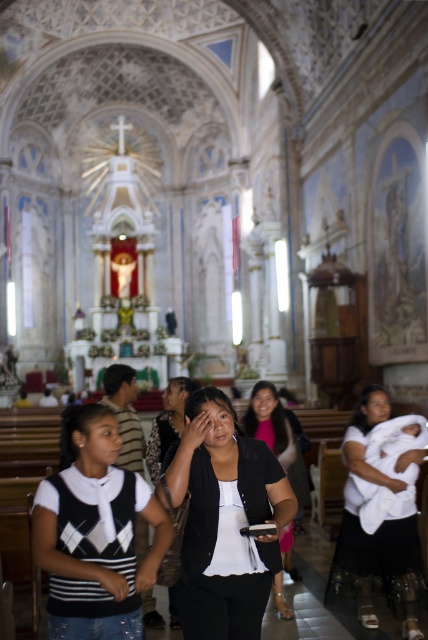
Question: Is black matte shirt at center further to the viewer compared to white knit sweater at center?

Choices:
 (A) yes
 (B) no

Answer: (A)

Question: Is black matte shirt at center in front of matte black shirt at center?

Choices:
 (A) yes
 (B) no

Answer: (A)

Question: Which of the following is the farthest from the observer?

Choices:
 (A) white knit sweater at center
 (B) black matte dress at center
 (C) black matte shirt at center

Answer: (C)

Question: Which object is positioned farthest from the white knit sweater at center?

Choices:
 (A) black matte dress at center
 (B) white cloth at center
 (C) black matte shirt at center
 (D) matte black shirt at center

Answer: (B)

Question: Is black matte dress at center positioned behind matte black shirt at center?

Choices:
 (A) no
 (B) yes

Answer: (A)

Question: Estimate the real-world distances between objects in this image. Which object is farther from the white cloth at center?

Choices:
 (A) white knit sweater at center
 (B) black matte dress at center

Answer: (A)